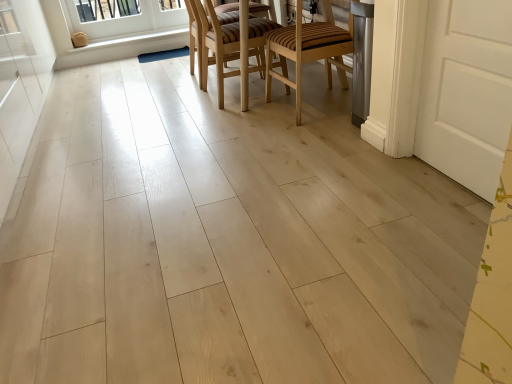
Image resolution: width=512 pixels, height=384 pixels. Describe the element at coordinates (217, 46) in the screenshot. I see `wooden chair at center, which is the first chair in left-to-right order` at that location.

I want to click on white wood screen door at left, so click(x=21, y=85).

Identify the location of wooden chair at center, which is the first chair in left-to-right order. (217, 46).

Looking at this image, is white painted wood at upper left not close to white wood screen door at left?

white painted wood at upper left is far away from white wood screen door at left.

Between white painted wood at upper left and white wood screen door at left, which one has larger size?

white wood screen door at left is bigger.

Does white painted wood at upper left turn towards white wood screen door at left?

No, white painted wood at upper left is not aimed at white wood screen door at left.

Is wooden chair at center, which is the first chair in left-to-right order, located outside white wood window at upper left?

Yes, wooden chair at center, which is the first chair in left-to-right order, is located beyond the bounds of white wood window at upper left.

From their relative heights in the image, would you say wooden chair at center, which is the 2th chair from right to left, is taller or shorter than white wood window at upper left?

Clearly, wooden chair at center, which is the 2th chair from right to left, is taller compared to white wood window at upper left.

What's the angular difference between wooden chair at center, which is the 2th chair from right to left, and white wood window at upper left's facing directions?

The facing directions of wooden chair at center, which is the 2th chair from right to left, and white wood window at upper left are 91.2 degrees apart.

Would you say white wood window at upper left is part of white painted wood at upper left's contents?

No.

How much distance is there between white painted wood at upper left and white wood window at upper left?

8.01 inches.

Which is behind, white painted wood at upper left or white wood window at upper left?

white wood window at upper left is behind.

Does white painted wood at upper left turn towards white wood window at upper left?

No, white painted wood at upper left is not facing towards white wood window at upper left.

Is white wood window at upper left facing towards white wood screen door at left?

Yes, white wood window at upper left is turned towards white wood screen door at left.

Who is shorter, white wood window at upper left or white wood screen door at left?

With less height is white wood window at upper left.

Which is closer, [120,3] or [25,119]?

Clearly, point [120,3] is more distant from the camera than point [25,119].

Which object is further away from the camera, white wood window at upper left or white wood screen door at left?

white wood window at upper left is more distant.

Where is `chair that is the 2nd object to the right of the white wood window at upper left, starting at the anchor`? chair that is the 2nd object to the right of the white wood window at upper left, starting at the anchor is located at coordinates (309, 50).

Is wooden striped chair at center, which ranks as the 1th chair in right-to-left order, facing towards white wood window at upper left?

Yes, wooden striped chair at center, which ranks as the 1th chair in right-to-left order, is facing white wood window at upper left.

Looking at this image, is wooden striped chair at center, which ranks as the 1th chair in right-to-left order, outside of white wood window at upper left?

Indeed, wooden striped chair at center, which ranks as the 1th chair in right-to-left order, is completely outside white wood window at upper left.

Does wooden striped chair at center, which ranks as the 1th chair in right-to-left order, lie in front of white wood window at upper left?

Yes, the depth of wooden striped chair at center, which ranks as the 1th chair in right-to-left order, is less than that of white wood window at upper left.

Between wooden chair at center, which is the first chair in left-to-right order, and white wood screen door at left, which one has larger width?

white wood screen door at left.

Considering the sizes of wooden chair at center, which is the 2th chair from right to left, and white wood screen door at left in the image, is wooden chair at center, which is the 2th chair from right to left, bigger or smaller than white wood screen door at left?

Clearly, wooden chair at center, which is the 2th chair from right to left, is smaller in size than white wood screen door at left.

Is white wood screen door at left inside wooden chair at center, which is the 2th chair from right to left?

That's incorrect, white wood screen door at left is not inside wooden chair at center, which is the 2th chair from right to left.

Locate an element on the screen. Image resolution: width=512 pixels, height=384 pixels. screen door that appears on the left of wooden chair at center, which is the first chair in left-to-right order is located at coordinates (21, 85).

Based on their positions, is wooden chair at center, which is the 2th chair from right to left, located to the left or right of wooden striped chair at center, which ranks as the 1th chair in right-to-left order?

Based on their positions, wooden chair at center, which is the 2th chair from right to left, is located to the left of wooden striped chair at center, which ranks as the 1th chair in right-to-left order.

Locate an element on the screen. chair above the wooden striped chair at center, which is the 2th chair in left-to-right order (from a real-world perspective) is located at coordinates (217, 46).

Is wooden chair at center, which is the first chair in left-to-right order, placed right next to wooden striped chair at center, which is the 2th chair in left-to-right order?

No, wooden chair at center, which is the first chair in left-to-right order, is not next to wooden striped chair at center, which is the 2th chair in left-to-right order.

Is wooden chair at center, which is the 2th chair from right to left, turned away from wooden striped chair at center, which ranks as the 1th chair in right-to-left order?

No, wooden chair at center, which is the 2th chair from right to left, is not facing away from wooden striped chair at center, which ranks as the 1th chair in right-to-left order.

Where is `window sill behind the white wood screen door at left`? This screenshot has width=512, height=384. window sill behind the white wood screen door at left is located at coordinates (131, 46).

Locate an element on the screen. the 1st chair in front of the white wood window at upper left, starting your count from the anchor is located at coordinates (217, 46).

Based on their spatial positions, is white wood window at upper left or wooden chair at center, which is the first chair in left-to-right order, further from wooden striped chair at center, which ranks as the 1th chair in right-to-left order?

white wood window at upper left lies further to wooden striped chair at center, which ranks as the 1th chair in right-to-left order, than the other object.

Based on their spatial positions, is wooden striped chair at center, which is the 2th chair in left-to-right order, or white wood screen door at left further from white painted wood at upper left?

The object further to white painted wood at upper left is wooden striped chair at center, which is the 2th chair in left-to-right order.

From the image, which object appears to be farther from white painted wood at upper left, wooden chair at center, which is the first chair in left-to-right order, or white wood screen door at left?

wooden chair at center, which is the first chair in left-to-right order.

Which object lies further to the anchor point wooden chair at center, which is the 2th chair from right to left, wooden striped chair at center, which is the 2th chair in left-to-right order, or white wood window at upper left?

Among the two, white wood window at upper left is located further to wooden chair at center, which is the 2th chair from right to left.

Estimate the real-world distances between objects in this image. Which object is closer to white wood window at upper left, white wood screen door at left or wooden striped chair at center, which ranks as the 1th chair in right-to-left order?

white wood screen door at left.

Considering their positions, is wooden striped chair at center, which is the 2th chair in left-to-right order, positioned further to wooden chair at center, which is the first chair in left-to-right order, than white painted wood at upper left?

white painted wood at upper left.

Based on the photo, considering their positions, is white painted wood at upper left positioned further to wooden striped chair at center, which is the 2th chair in left-to-right order, than wooden chair at center, which is the first chair in left-to-right order?

Based on the image, white painted wood at upper left appears to be further to wooden striped chair at center, which is the 2th chair in left-to-right order.

From the image, which object appears to be farther from white painted wood at upper left, wooden chair at center, which is the first chair in left-to-right order, or white wood window at upper left?

The object further to white painted wood at upper left is wooden chair at center, which is the first chair in left-to-right order.

This screenshot has height=384, width=512. What are the coordinates of `window sill positioned between wooden chair at center, which is the 2th chair from right to left, and white wood window at upper left from near to far` in the screenshot? It's located at (131, 46).

This screenshot has width=512, height=384. I want to click on chair between white wood screen door at left and wooden striped chair at center, which is the 2th chair in left-to-right order, from left to right, so click(217, 46).

Identify the location of chair between wooden striped chair at center, which ranks as the 1th chair in right-to-left order, and white wood window at upper left, along the z-axis. (217, 46).

Where is `chair located between wooden striped chair at center, which ranks as the 1th chair in right-to-left order, and white painted wood at upper left in the depth direction`? The height and width of the screenshot is (384, 512). chair located between wooden striped chair at center, which ranks as the 1th chair in right-to-left order, and white painted wood at upper left in the depth direction is located at coordinates (217, 46).